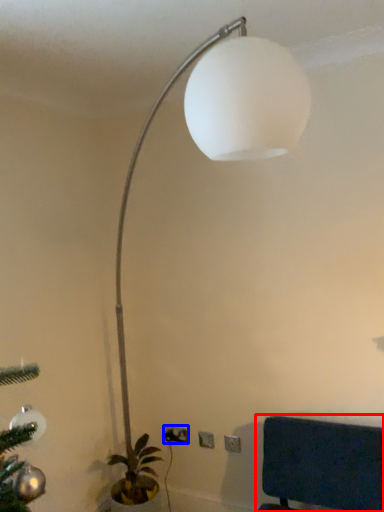
Question: Which of the following is the closest to the observer, furniture (highlighted by a red box) or electric outlet (highlighted by a blue box)?

Choices:
 (A) furniture
 (B) electric outlet

Answer: (A)